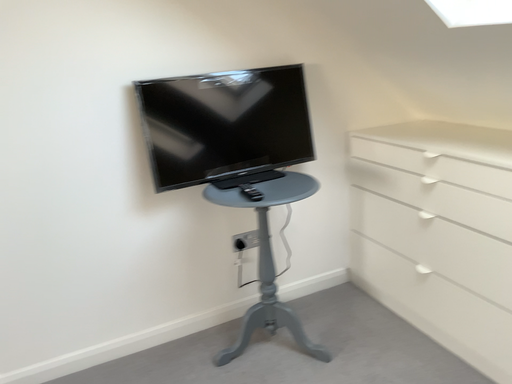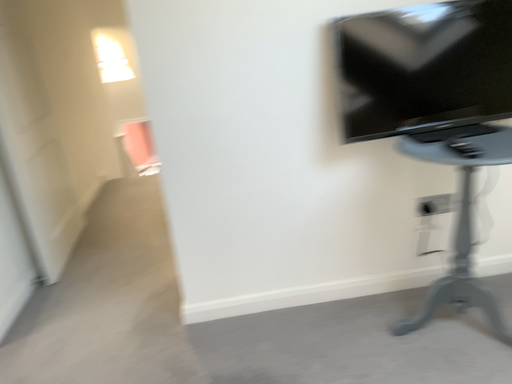
Question: Which way did the camera rotate in the video?

Choices:
 (A) rotated right
 (B) rotated left

Answer: (B)